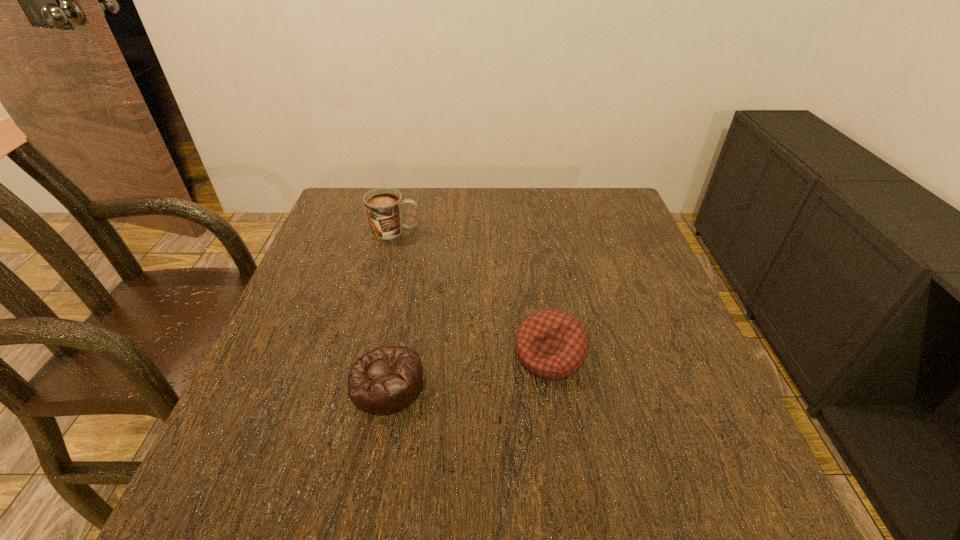
Where is `vacant area that lies between the farthest object and the shorter beanbag`? This screenshot has width=960, height=540. vacant area that lies between the farthest object and the shorter beanbag is located at coordinates (392, 307).

Find the location of a particular element. vacant space in between the taller beanbag and the farthest object is located at coordinates (473, 293).

The image size is (960, 540). Identify the location of free space between the rightmost object and the mug. (473, 293).

Where is `vacant point located between the mug and the rightmost object`? vacant point located between the mug and the rightmost object is located at coordinates (473, 293).

The width and height of the screenshot is (960, 540). Find the location of `free space between the shortest object and the rightmost object`. free space between the shortest object and the rightmost object is located at coordinates (468, 369).

Locate an element on the screen. This screenshot has width=960, height=540. unoccupied area between the second shortest object and the left beanbag is located at coordinates (468, 369).

Select which object appears as the second closest to the rightmost object. Please provide its 2D coordinates. Your answer should be formatted as a tuple, i.e. [(x, y)], where the tuple contains the x and y coordinates of a point satisfying the conditions above.

[(384, 206)]

Identify which object is located as the second nearest to the taller beanbag. Please provide its 2D coordinates. Your answer should be formatted as a tuple, i.e. [(x, y)], where the tuple contains the x and y coordinates of a point satisfying the conditions above.

[(384, 206)]

I want to click on vacant space that satisfies the following two spatial constraints: 1. on the side of the farthest object with the handle; 2. on the left side of the right beanbag, so click(366, 355).

This screenshot has height=540, width=960. In order to click on free spot that satisfies the following two spatial constraints: 1. on the side of the shorter beanbag with the handle; 2. on the right side of the tallest object in this screenshot , I will do `click(358, 384)`.